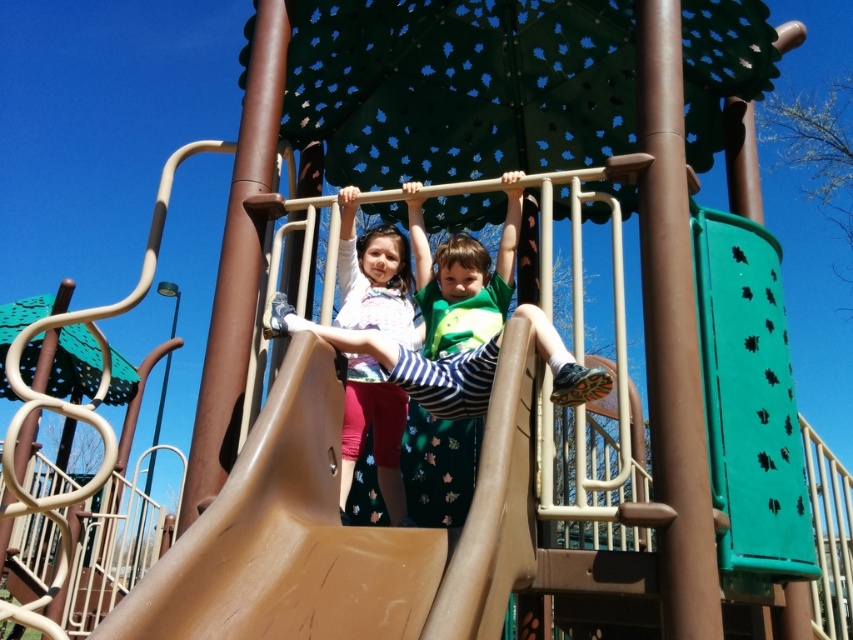
You are a photographer trying to capture a group photo of the matte striped shirt at center and the matte white shirt at center. Since you want both shirts to appear the same size in the photo, which direction should you move your camera relative to the current position?

To make the matte striped shirt at center and the matte white shirt at center appear the same size in the photo, you should move the camera closer to the matte striped shirt at center because it is smaller than the matte white shirt at center.

Consider the image. You are a parent trying to ensure safety for your children at the playground. You notice the brown matte slide at center and the matte striped shirt at center. Which object is narrower?

The brown matte slide at center is narrower than the matte striped shirt at center.

You are a parent standing at the edge of the playground. You want to ensure your child can safely reach the brown matte slide at center. Considering the distance from where you are standing to the slide is 1.79 meters, can a child who can walk independently cover this distance without assistance?

The distance between the brown matte slide at center and the camera is 1.79 meters. Since the child can walk independently, they can cover the 1.79 meters to the slide without needing help.